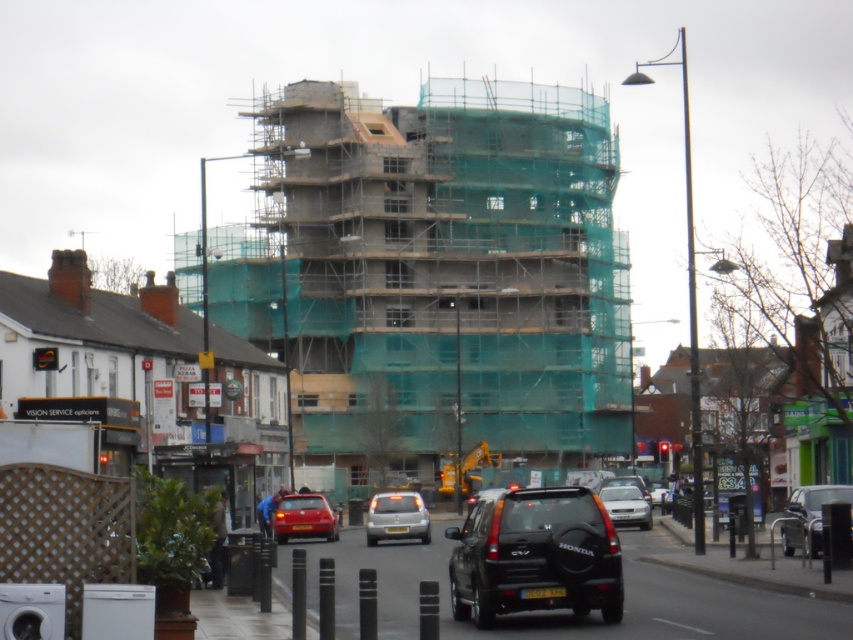
Which is above, black matte honda suv at center or matte black suv at center?

Positioned higher is black matte honda suv at center.

Is black matte honda suv at center further to camera compared to matte black suv at center?

No, black matte honda suv at center is closer to the viewer.

The image size is (853, 640). Describe the element at coordinates (535, 556) in the screenshot. I see `black matte honda suv at center` at that location.

Image resolution: width=853 pixels, height=640 pixels. What are the coordinates of `black matte honda suv at center` in the screenshot? It's located at (535, 556).

Which is in front, point (381, 536) or point (613, 502)?

Point (381, 536) is more forward.

Is silver metallic car at center smaller than silver metallic sedan at center?

Incorrect, silver metallic car at center is not smaller in size than silver metallic sedan at center.

Find the location of a particular element. silver metallic car at center is located at coordinates (396, 516).

From the picture: Who is more distant from viewer, (824,484) or (428,541)?

Point (824,484)

Does matte black suv at center come behind silver metallic car at center?

That is False.

Is point (827, 502) behind point (384, 499)?

No, (827, 502) is closer to viewer.

The height and width of the screenshot is (640, 853). Identify the location of matte black suv at center. (809, 515).